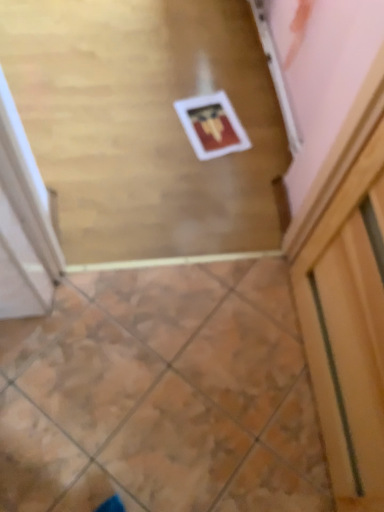
You are a GUI agent. You are given a task and a screenshot of the screen. Output one action in this format:
    pyautogui.click(x=<x>, y=<y>)
    Task: Click on the free space above wooden floor at center (from a real-world perspective)
    The width and height of the screenshot is (384, 512).
    Given the screenshot: What is the action you would take?
    pyautogui.click(x=140, y=103)